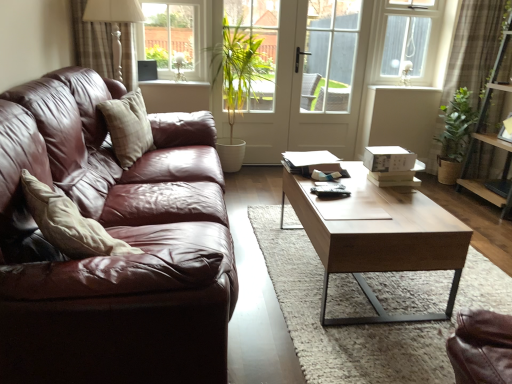
Question: Is plaid fabric curtain at upper left, placed as the first curtain when sorted from left to right, not near white glass screen door at center?

Choices:
 (A) no
 (B) yes

Answer: (B)

Question: Is plaid fabric curtain at upper left, the second curtain positioned from the right, taller than white glass screen door at center?

Choices:
 (A) yes
 (B) no

Answer: (B)

Question: Is plaid fabric curtain at upper left, placed as the first curtain when sorted from left to right, shorter than white glass screen door at center?

Choices:
 (A) yes
 (B) no

Answer: (A)

Question: Does plaid fabric curtain at upper left, the second curtain positioned from the right, appear on the right side of white glass screen door at center?

Choices:
 (A) no
 (B) yes

Answer: (A)

Question: From a real-world perspective, is plaid fabric curtain at upper left, the second curtain positioned from the right, physically below white glass screen door at center?

Choices:
 (A) yes
 (B) no

Answer: (B)

Question: Can you confirm if plaid fabric curtain at upper left, placed as the first curtain when sorted from left to right, is smaller than white glass screen door at center?

Choices:
 (A) yes
 (B) no

Answer: (A)

Question: Is clear glass window at upper right, which is the 1th window from right to left, in front of beige fabric pillow at left?

Choices:
 (A) no
 (B) yes

Answer: (A)

Question: Could you tell me if clear glass window at upper right, which is the second window from left to right, is turned towards beige fabric pillow at left?

Choices:
 (A) yes
 (B) no

Answer: (B)

Question: From the image's perspective, is clear glass window at upper right, which is the second window from left to right, beneath beige fabric pillow at left?

Choices:
 (A) no
 (B) yes

Answer: (A)

Question: From the image's perspective, is clear glass window at upper right, which is the second window from left to right, above beige fabric pillow at left?

Choices:
 (A) no
 (B) yes

Answer: (B)

Question: From a real-world perspective, is clear glass window at upper right, which is the second window from left to right, physically above beige fabric pillow at left?

Choices:
 (A) no
 (B) yes

Answer: (B)

Question: Is clear glass window at upper right, which is the 1th window from right to left, positioned behind beige fabric pillow at left?

Choices:
 (A) yes
 (B) no

Answer: (A)

Question: From a real-world perspective, does white glossy window sill at upper center, acting as the second window sill starting from the front, stand above brown textured curtain at upper right, arranged as the 2th curtain when viewed from the left?

Choices:
 (A) no
 (B) yes

Answer: (B)